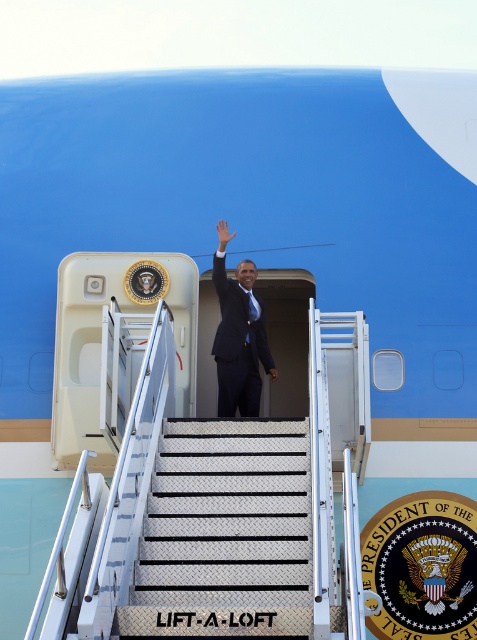
Question: Which object appears farthest from the camera in this image?

Choices:
 (A) diamond plate metal stairs at center
 (B) white matte hand at center

Answer: (B)

Question: Which object is positioned closest to the white matte hand at center?

Choices:
 (A) diamond plate metal stairs at center
 (B) dark blue suit at center

Answer: (B)

Question: Can you confirm if diamond plate metal stairs at center is positioned above dark blue suit at center?

Choices:
 (A) no
 (B) yes

Answer: (A)

Question: Which point appears farthest from the camera in this image?

Choices:
 (A) (279, 554)
 (B) (247, 305)

Answer: (B)

Question: Is diamond plate metal stairs at center closer to the viewer compared to white matte hand at center?

Choices:
 (A) yes
 (B) no

Answer: (A)

Question: Is the position of diamond plate metal stairs at center more distant than that of dark blue suit at center?

Choices:
 (A) no
 (B) yes

Answer: (A)